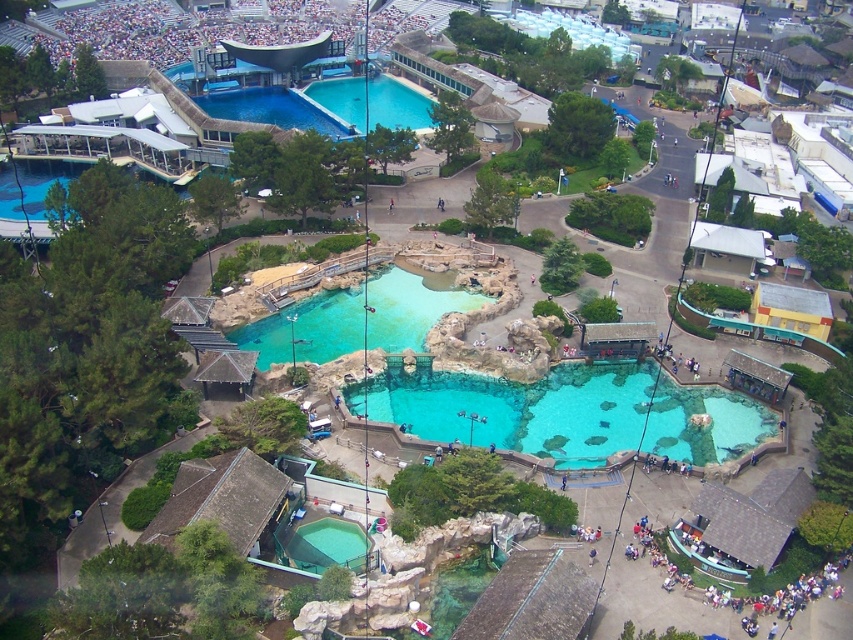
You are a visitor standing at the entrance of the zoo and want to take a photo of the turquoise glass pool at center and the clear blue water at upper center. Which one will appear larger in your photo?

The turquoise glass pool at center will appear larger in your photo because it is closer to the viewer than the clear blue water at upper center.

You are a zookeeper planning to clean the clear glass pool at center and the turquoise glass pool at center. If you start from the leftmost pavilion, which pool should you visit first according to their positions?

Since the clear glass pool at center is to the right of the turquoise glass pool at center, you should visit the turquoise glass pool at center first when starting from the leftmost pavilion.